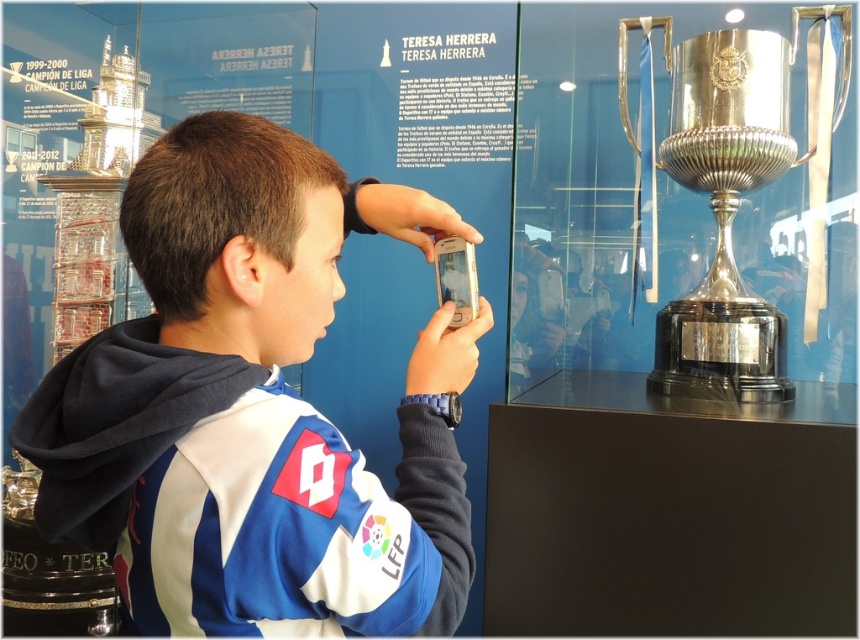
Where is the brown hair at upper center located in the image?

The brown hair at upper center is located at point (237, 236) in the image.

You are a photographer trying to capture the polished silver trophy at right. The boy with brown hair at upper center is blocking your view. Can you tell me which object is closer to you so you can adjust your position?

The brown hair at upper center is closer to the viewer than the polished silver trophy at right, so you should move around the boy to get a clear view of the trophy.